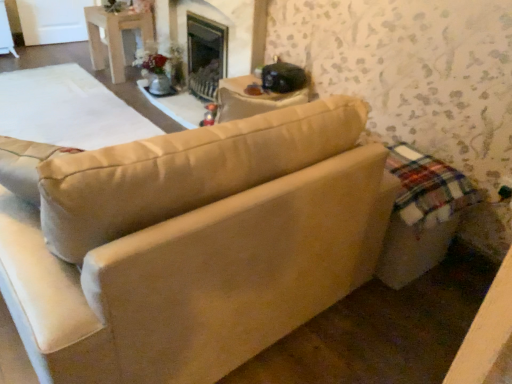
Question: From a real-world perspective, is white wood table at upper left above or below beige fabric couch at center?

Choices:
 (A) above
 (B) below

Answer: (B)

Question: Is white wood table at upper left spatially inside beige fabric couch at center, or outside of it?

Choices:
 (A) outside
 (B) inside

Answer: (A)

Question: From the image's perspective, is white wood table at upper left positioned above or below beige fabric couch at center?

Choices:
 (A) below
 (B) above

Answer: (B)

Question: From the image's perspective, relative to white wood table at upper left, is beige fabric couch at center above or below?

Choices:
 (A) above
 (B) below

Answer: (B)

Question: Relative to white wood table at upper left, is beige fabric couch at center in front or behind?

Choices:
 (A) behind
 (B) front

Answer: (B)

Question: Is point (44, 292) closer or farther from the camera than point (94, 39)?

Choices:
 (A) farther
 (B) closer

Answer: (B)

Question: In terms of size, does beige fabric couch at center appear bigger or smaller than white wood table at upper left?

Choices:
 (A) small
 (B) big

Answer: (B)